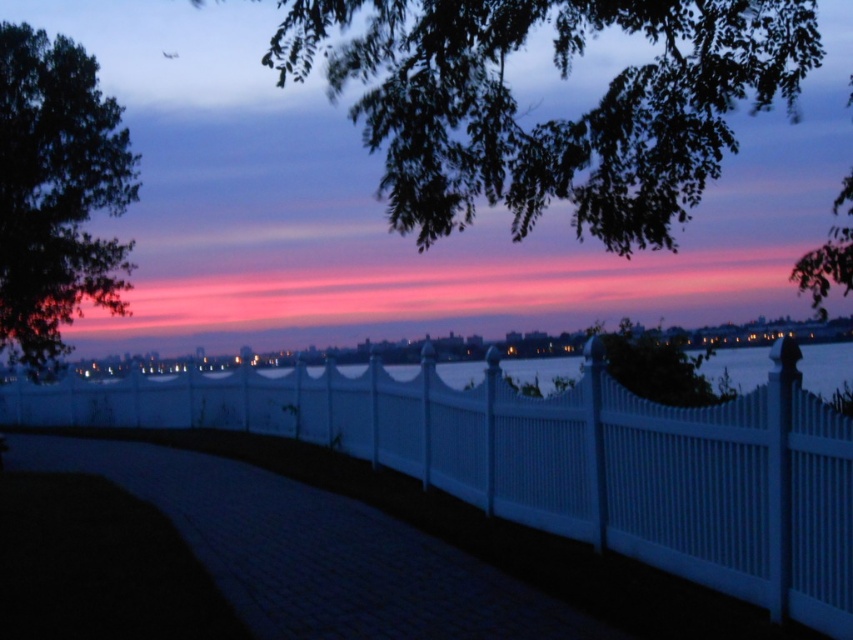
Question: Estimate the real-world distances between objects in this image. Which object is closer to the white vinyl fence at center?

Choices:
 (A) green leafy branches at upper center
 (B) dark green leafy tree at upper left

Answer: (A)

Question: Is white vinyl fence at center above dark green leafy tree at upper left?

Choices:
 (A) yes
 (B) no

Answer: (B)

Question: Estimate the real-world distances between objects in this image. Which object is closer to the white vinyl fence at center?

Choices:
 (A) dark green leafy tree at upper left
 (B) green leafy branches at upper center

Answer: (B)

Question: Can you confirm if white vinyl fence at center is positioned above dark green leafy tree at upper left?

Choices:
 (A) no
 (B) yes

Answer: (A)

Question: Which of these objects is positioned farthest from the white vinyl fence at center?

Choices:
 (A) green leafy branches at upper center
 (B) dark green leafy tree at upper left

Answer: (B)

Question: Can you confirm if white vinyl fence at center is smaller than green leafy branches at upper center?

Choices:
 (A) yes
 (B) no

Answer: (A)